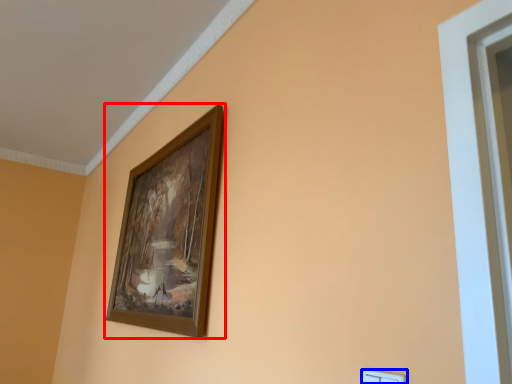
Question: Which of the following is the farthest to the observer, picture frame (highlighted by a red box) or light switch (highlighted by a blue box)?

Choices:
 (A) picture frame
 (B) light switch

Answer: (A)